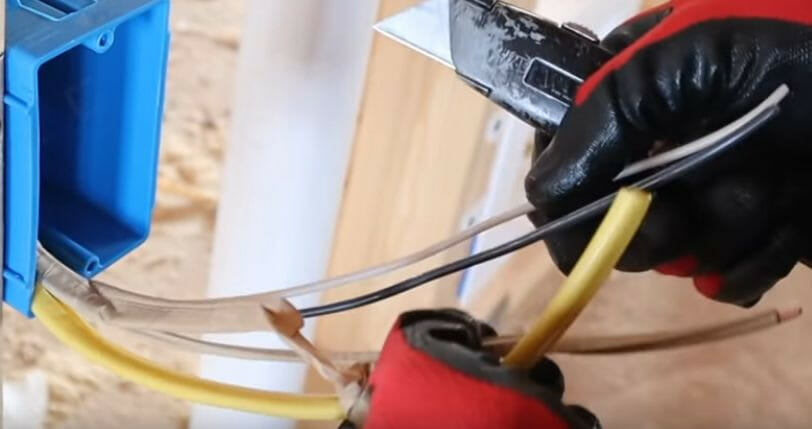
Where is `stucco wall`? This screenshot has width=812, height=429. stucco wall is located at coordinates (201, 142).